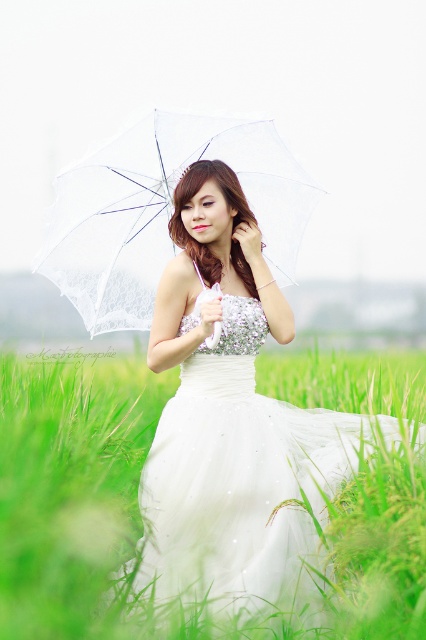
Question: Can you confirm if white satin dress at center is positioned above transparent fabric umbrella at center?

Choices:
 (A) no
 (B) yes

Answer: (A)

Question: Which point is closer to the camera?

Choices:
 (A) (232, 218)
 (B) (123, 170)

Answer: (A)

Question: Which point is closer to the camera taking this photo?

Choices:
 (A) (184, 209)
 (B) (279, 154)

Answer: (A)

Question: Does white satin dress at center have a smaller size compared to transparent fabric umbrella at center?

Choices:
 (A) yes
 (B) no

Answer: (B)

Question: Where is white satin dress at center located in relation to transparent fabric umbrella at center in the image?

Choices:
 (A) right
 (B) left

Answer: (A)

Question: Which of the following is the closest to the observer?

Choices:
 (A) (385, 608)
 (B) (72, 252)

Answer: (A)